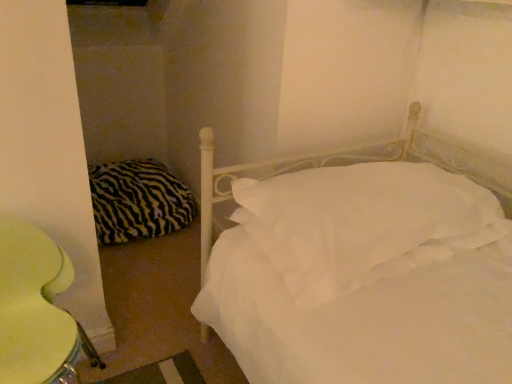
What do you see at coordinates (37, 310) in the screenshot? I see `yellow fabric swivel chair at lower left` at bounding box center [37, 310].

How much space does white soft pillow at center, positioned as the 1th pillow in right-to-left order, occupy horizontally?

white soft pillow at center, positioned as the 1th pillow in right-to-left order, is 33.10 inches in width.

The width and height of the screenshot is (512, 384). I want to click on yellow fabric swivel chair at lower left, so click(x=37, y=310).

How distant is yellow fabric swivel chair at lower left from zebra-patterned fabric pillow at left, the second pillow when ordered from front to back?

yellow fabric swivel chair at lower left and zebra-patterned fabric pillow at left, the second pillow when ordered from front to back, are 1.02 meters apart.

Is point (6, 290) closer or farther from the camera than point (169, 197)?

Point (6, 290) appears to be closer to the viewer than point (169, 197).

Does yellow fabric swivel chair at lower left turn towards zebra-patterned fabric pillow at left, the second pillow when ordered from front to back?

No, yellow fabric swivel chair at lower left is not oriented towards zebra-patterned fabric pillow at left, the second pillow when ordered from front to back.

From the image's perspective, is yellow fabric swivel chair at lower left on zebra-patterned fabric pillow at left, the second pillow when ordered from front to back?

No, from the image's perspective, yellow fabric swivel chair at lower left is not above zebra-patterned fabric pillow at left, the second pillow when ordered from front to back.

Is yellow fabric swivel chair at lower left positioned far away from white soft pillow at center, which is counted as the 2th pillow, starting from the left?

yellow fabric swivel chair at lower left is actually quite close to white soft pillow at center, which is counted as the 2th pillow, starting from the left.

Is yellow fabric swivel chair at lower left positioned behind white soft pillow at center, which is counted as the 1th pillow, starting from the front?

That is False.

From a real-world perspective, is yellow fabric swivel chair at lower left located higher than white soft pillow at center, which is counted as the 1th pillow, starting from the front?

No, from a real-world perspective, yellow fabric swivel chair at lower left is not above white soft pillow at center, which is counted as the 1th pillow, starting from the front.

Is white soft pillow at center, which is counted as the 1th pillow, starting from the front, wider than yellow fabric swivel chair at lower left?

Yes, white soft pillow at center, which is counted as the 1th pillow, starting from the front, is wider than yellow fabric swivel chair at lower left.

Is yellow fabric swivel chair at lower left inside white soft pillow at center, which is counted as the 1th pillow, starting from the front?

Definitely not — yellow fabric swivel chair at lower left is not inside white soft pillow at center, which is counted as the 1th pillow, starting from the front.

From the image's perspective, is white soft pillow at center, which is counted as the 2th pillow, starting from the back, above or below yellow fabric swivel chair at lower left?

From the image's perspective, white soft pillow at center, which is counted as the 2th pillow, starting from the back, appears above yellow fabric swivel chair at lower left.

In order to click on swivel chair that is below the white soft pillow at center, which is counted as the 1th pillow, starting from the front (from the image's perspective) in this screenshot , I will do `click(37, 310)`.

Could you tell me if white soft pillow at center, which is counted as the 1th pillow, starting from the front, is facing zebra-patterned fabric pillow at left, the 1th pillow from the back?

No, white soft pillow at center, which is counted as the 1th pillow, starting from the front, is not facing towards zebra-patterned fabric pillow at left, the 1th pillow from the back.

Considering the relative positions of white soft pillow at center, positioned as the 1th pillow in right-to-left order, and zebra-patterned fabric pillow at left, the 1th pillow from the back, in the image provided, is white soft pillow at center, positioned as the 1th pillow in right-to-left order, to the left or to the right of zebra-patterned fabric pillow at left, the 1th pillow from the back,?

In the image, white soft pillow at center, positioned as the 1th pillow in right-to-left order, appears on the right side of zebra-patterned fabric pillow at left, the 1th pillow from the back.

How much distance is there between white soft pillow at center, which is counted as the 2th pillow, starting from the back, and zebra-patterned fabric pillow at left, the second pillow when ordered from front to back?

white soft pillow at center, which is counted as the 2th pillow, starting from the back, and zebra-patterned fabric pillow at left, the second pillow when ordered from front to back, are 1.26 meters apart from each other.

Identify the location of pillow that is under the white soft pillow at center, which is counted as the 1th pillow, starting from the front (from a real-world perspective). (138, 200).

What's the angular difference between zebra-patterned fabric pillow at left, the 1th pillow from the back, and yellow fabric swivel chair at lower left's facing directions?

zebra-patterned fabric pillow at left, the 1th pillow from the back, and yellow fabric swivel chair at lower left are facing 0.398 degrees away from each other.

Considering the sizes of objects zebra-patterned fabric pillow at left, the 1th pillow from the back, and yellow fabric swivel chair at lower left in the image provided, who is thinner, zebra-patterned fabric pillow at left, the 1th pillow from the back, or yellow fabric swivel chair at lower left?

Thinner between the two is yellow fabric swivel chair at lower left.

From the image's perspective, is zebra-patterned fabric pillow at left, the 1th pillow from the back, located above or below yellow fabric swivel chair at lower left?

zebra-patterned fabric pillow at left, the 1th pillow from the back, is above yellow fabric swivel chair at lower left.

Considering the points (162, 195) and (33, 285), which point is in front, point (162, 195) or point (33, 285)?

The point (33, 285) is closer to the camera.

Is zebra-patterned fabric pillow at left, the second pillow when ordered from front to back, taller or shorter than white soft pillow at center, which is counted as the 2th pillow, starting from the left?

Considering their sizes, zebra-patterned fabric pillow at left, the second pillow when ordered from front to back, has more height than white soft pillow at center, which is counted as the 2th pillow, starting from the left.

Can you tell me how much zebra-patterned fabric pillow at left, the 1th pillow positioned from the left, and white soft pillow at center, which is counted as the 2th pillow, starting from the back, differ in facing direction?

There is a 88-degree angle between the facing directions of zebra-patterned fabric pillow at left, the 1th pillow positioned from the left, and white soft pillow at center, which is counted as the 2th pillow, starting from the back.

Is zebra-patterned fabric pillow at left, the second pillow when ordered from front to back, in front of or behind white soft pillow at center, which is counted as the 2th pillow, starting from the back, in the image?

Clearly, zebra-patterned fabric pillow at left, the second pillow when ordered from front to back, is behind white soft pillow at center, which is counted as the 2th pillow, starting from the back.

Does zebra-patterned fabric pillow at left, the 1th pillow positioned from the left, have a greater width compared to white soft pillow at center, which is counted as the 2th pillow, starting from the left?

Incorrect, the width of zebra-patterned fabric pillow at left, the 1th pillow positioned from the left, does not surpass that of white soft pillow at center, which is counted as the 2th pillow, starting from the left.

Locate an element on the screen. The height and width of the screenshot is (384, 512). swivel chair that is below the zebra-patterned fabric pillow at left, the 1th pillow positioned from the left (from the image's perspective) is located at coordinates (37, 310).

From the image's perspective, count 1st pillows upward from the yellow fabric swivel chair at lower left and point to it. Please provide its 2D coordinates.

[(362, 223)]

Consider the image. Considering their positions, is zebra-patterned fabric pillow at left, placed as the second pillow when sorted from right to left, positioned closer to yellow fabric swivel chair at lower left than white soft pillow at center, which is counted as the 2th pillow, starting from the left?

white soft pillow at center, which is counted as the 2th pillow, starting from the left, is positioned closer to the anchor yellow fabric swivel chair at lower left.

Based on their spatial positions, is zebra-patterned fabric pillow at left, the 1th pillow from the back, or yellow fabric swivel chair at lower left closer to white soft pillow at center, which is counted as the 2th pillow, starting from the left?

yellow fabric swivel chair at lower left is closer to white soft pillow at center, which is counted as the 2th pillow, starting from the left.

Based on their spatial positions, is white soft pillow at center, which is counted as the 2th pillow, starting from the back, or zebra-patterned fabric pillow at left, the second pillow when ordered from front to back, further from yellow fabric swivel chair at lower left?

Among the two, zebra-patterned fabric pillow at left, the second pillow when ordered from front to back, is located further to yellow fabric swivel chair at lower left.

When comparing their distances from white soft pillow at center, positioned as the 1th pillow in right-to-left order, does yellow fabric swivel chair at lower left or zebra-patterned fabric pillow at left, the second pillow when ordered from front to back, seem further?

zebra-patterned fabric pillow at left, the second pillow when ordered from front to back, lies further to white soft pillow at center, positioned as the 1th pillow in right-to-left order, than the other object.

Estimate the real-world distances between objects in this image. Which object is closer to zebra-patterned fabric pillow at left, the 1th pillow from the back, white soft pillow at center, which is counted as the 1th pillow, starting from the front, or yellow fabric swivel chair at lower left?

Based on the image, yellow fabric swivel chair at lower left appears to be nearer to zebra-patterned fabric pillow at left, the 1th pillow from the back.

Considering their positions, is yellow fabric swivel chair at lower left positioned further to zebra-patterned fabric pillow at left, the 1th pillow from the back, than white soft pillow at center, positioned as the 1th pillow in right-to-left order?

Based on the image, white soft pillow at center, positioned as the 1th pillow in right-to-left order, appears to be further to zebra-patterned fabric pillow at left, the 1th pillow from the back.

At what (x,y) coordinates should I click in order to perform the action: click on pillow positioned between yellow fabric swivel chair at lower left and zebra-patterned fabric pillow at left, the 1th pillow from the back, from near to far. Please return your answer as a coordinate pair (x, y). Looking at the image, I should click on (362, 223).